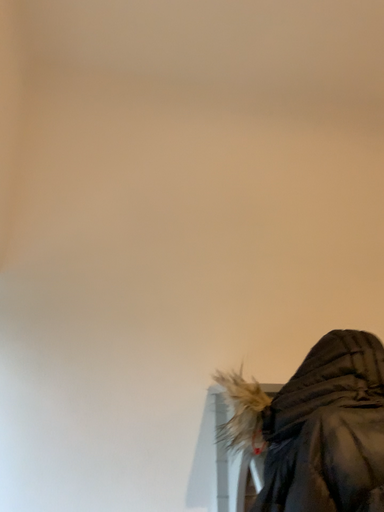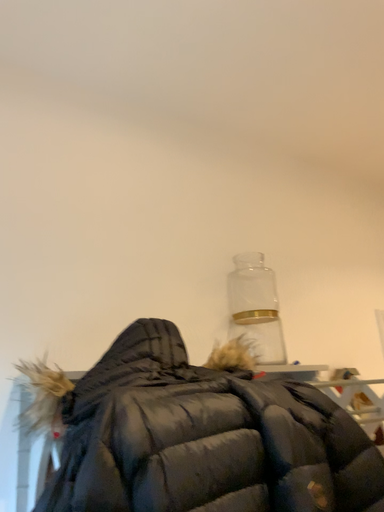
Question: How did the camera likely rotate when shooting the video?

Choices:
 (A) rotated right
 (B) rotated left

Answer: (A)